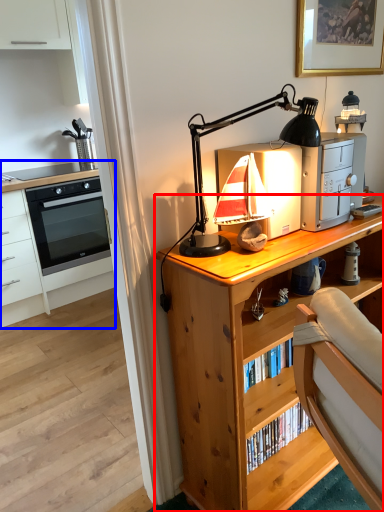
Question: Which of the following is the farthest to the observer, desk (highlighted by a red box) or chest of drawers (highlighted by a blue box)?

Choices:
 (A) desk
 (B) chest of drawers

Answer: (B)